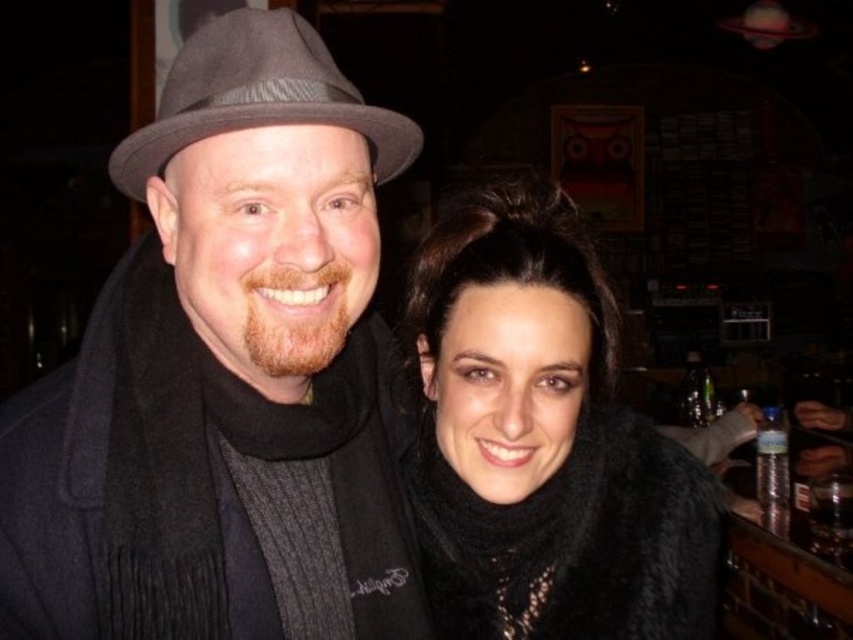
You are a photographer adjusting the lighting for a portrait. You notice the matte black coat at left and the gray felt fedora at upper left in the frame. Which object should you focus on first if you want to ensure the larger object is properly lit?

The matte black coat at left should be focused on first because it has a larger size compared to the gray felt fedora at upper left, ensuring proper lighting for the bigger object.

You are a photographer trying to adjust the lighting for a photo shoot. You have a spotlight that can only illuminate a specific point in the image. The coordinates given are for a point that corresponds to an object in the scene. Which object is located at the coordinates point (544, 444)?

The point (544, 444) marks the black fuzzy scarf at right.

You are a photographer adjusting the lighting in the scene. You need to place a spotlight exactly at the coordinates where the matte black coat at left is located. What are the coordinates you should set the spotlight to?

The coordinates for the matte black coat at left are at point (225, 376).